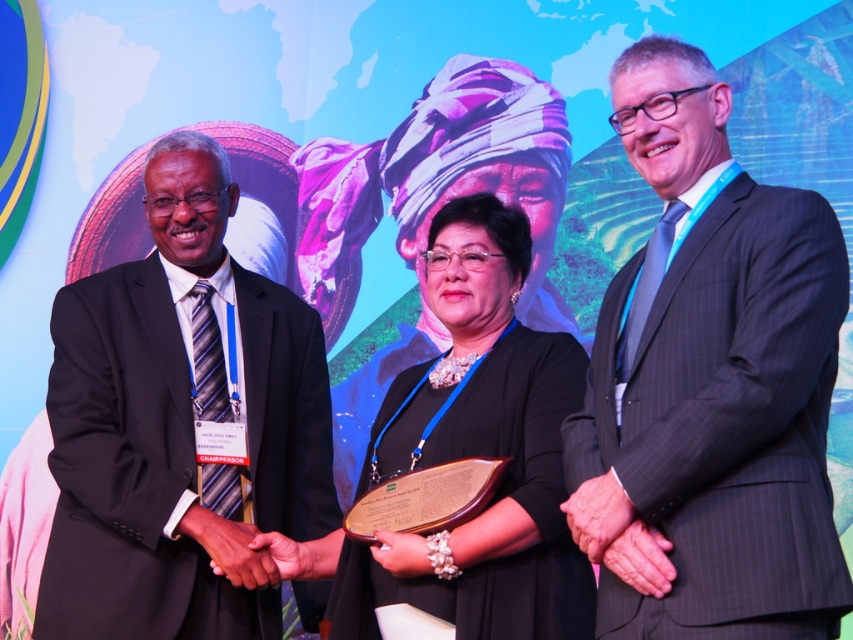
Question: Which point appears farthest from the camera in this image?

Choices:
 (A) (457, 385)
 (B) (827, 253)

Answer: (A)

Question: Observing the image, what is the correct spatial positioning of black pinstripe suit at left in reference to black satin dress at center?

Choices:
 (A) left
 (B) right

Answer: (A)

Question: Does gray pinstripe suit at center appear on the left side of black satin dress at center?

Choices:
 (A) no
 (B) yes

Answer: (A)

Question: Where is gray pinstripe suit at center located in relation to black satin dress at center in the image?

Choices:
 (A) above
 (B) below

Answer: (A)

Question: Which of the following is the closest to the observer?

Choices:
 (A) (231, 540)
 (B) (515, 282)

Answer: (A)

Question: Which is nearer to the black satin dress at center?

Choices:
 (A) gray pinstripe suit at center
 (B) black pinstripe suit at left

Answer: (A)